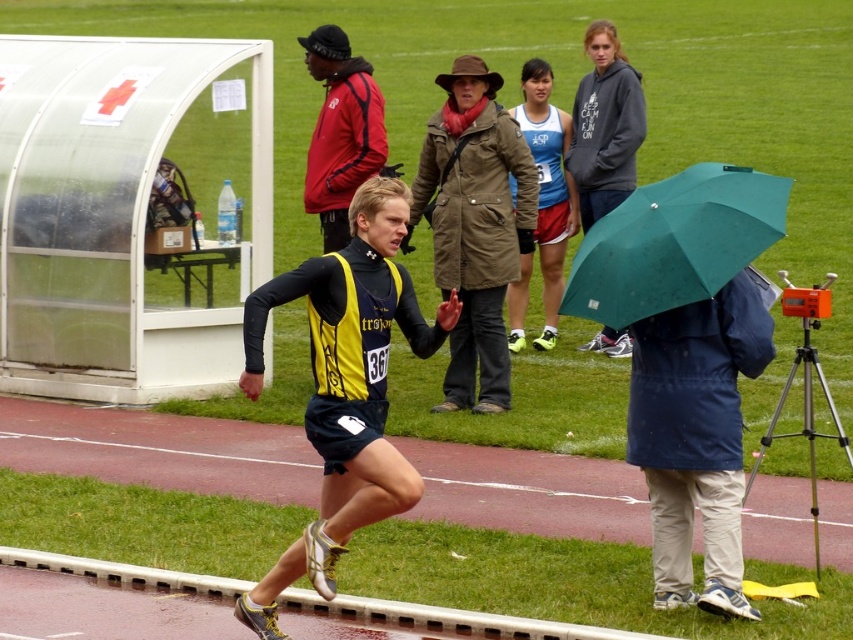
Question: Can you confirm if matte black jacket at upper left is thinner than blue fabric shorts at center?

Choices:
 (A) no
 (B) yes

Answer: (B)

Question: Considering the real-world distances, which object is closest to the green matte umbrella at right?

Choices:
 (A) matte black jacket at upper left
 (B) dark gray hoodie at upper center
 (C) yellow/black athletic top at center
 (D) blue fabric shorts at center

Answer: (C)

Question: Which is nearer to the yellow/black athletic top at center?

Choices:
 (A) green matte umbrella at right
 (B) dark gray hoodie at upper center
 (C) blue fabric shorts at center

Answer: (A)

Question: Does dark gray hoodie at upper center lie in front of blue fabric shorts at center?

Choices:
 (A) no
 (B) yes

Answer: (A)

Question: Is yellow/black athletic top at center positioned before blue fabric shorts at center?

Choices:
 (A) no
 (B) yes

Answer: (B)

Question: Which of the following is the farthest from the observer?

Choices:
 (A) (770, 220)
 (B) (350, 67)

Answer: (B)